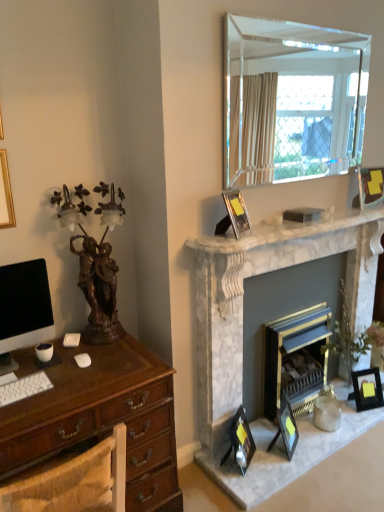
Image resolution: width=384 pixels, height=512 pixels. In order to click on blank space situated above matte black picture frame at right, arranged as the third picture frame when viewed from the top (from a real-world perspective) in this screenshot , I will do `click(370, 370)`.